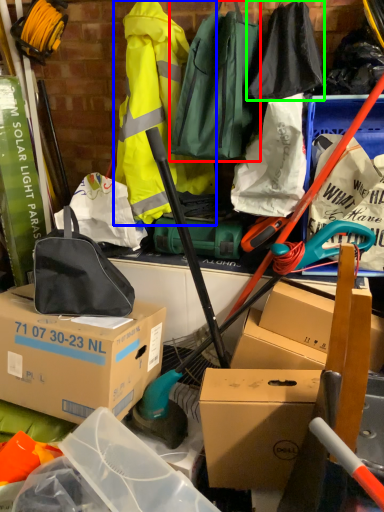
Question: Considering the real-world distances, which object is farthest from luggage and bags (highlighted by a red box)? clothing (highlighted by a blue box) or clothing (highlighted by a green box)?

Choices:
 (A) clothing
 (B) clothing

Answer: (A)